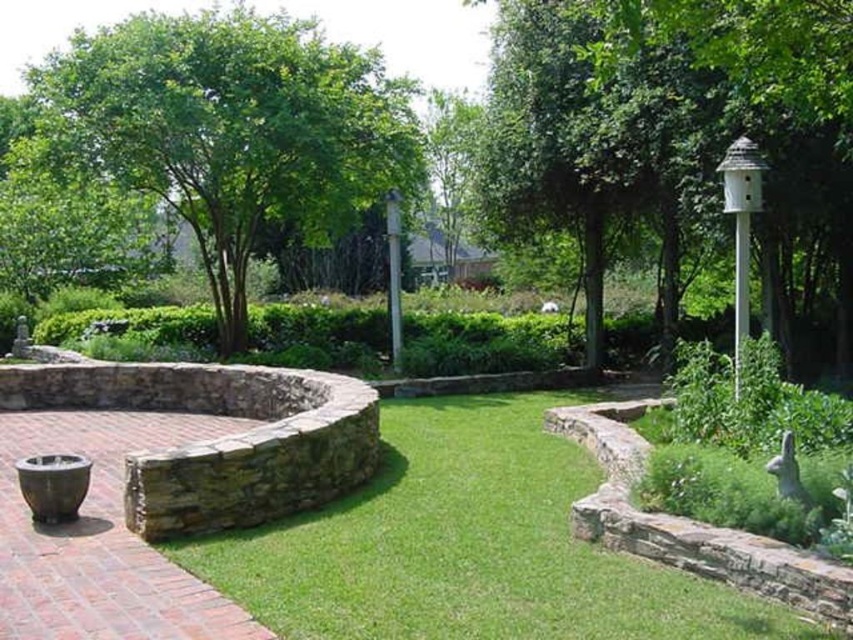
Between white wood birdhouse at upper right and green grass at center, which one appears on the left side from the viewer's perspective?

green grass at center

Which is in front, point (584, 154) or point (219, 554)?

Point (219, 554) is more forward.

Describe the element at coordinates (675, 132) in the screenshot. I see `white wood birdhouse at upper right` at that location.

Find the location of a particular element. white wood birdhouse at upper right is located at coordinates (675, 132).

Is point (633, 589) positioned after point (334, 426)?

No, (633, 589) is in front of (334, 426).

Where is `green grass at center`? The image size is (853, 640). green grass at center is located at coordinates (469, 545).

Does white wood birdhouse at upper right appear on the right side of green leafy tree at upper left?

Yes, white wood birdhouse at upper right is to the right of green leafy tree at upper left.

Is point (804, 154) farther from camera compared to point (166, 129)?

No.

Where is `white wood birdhouse at upper right`? white wood birdhouse at upper right is located at coordinates pos(675,132).